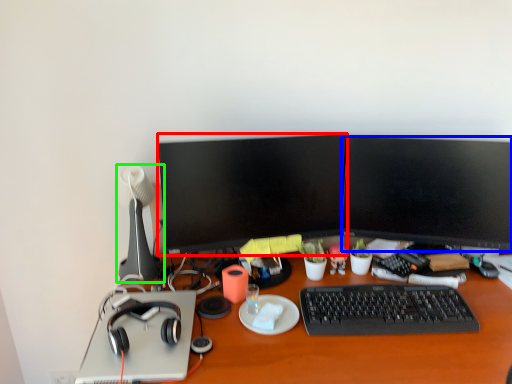
Question: Which object is positioned farthest from television (highlighted by a red box)? Select from television (highlighted by a blue box) and lamp (highlighted by a green box).

Choices:
 (A) television
 (B) lamp

Answer: (B)